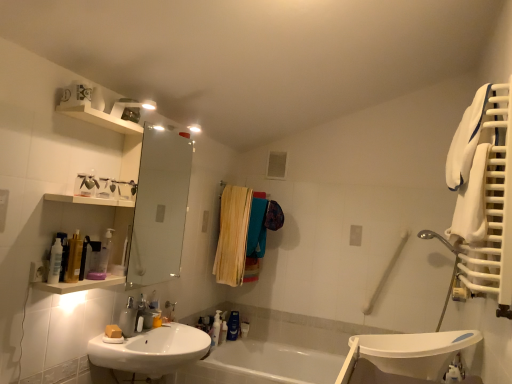
Question: Is white glossy bathtub at center situated inside translucent plastic bottle at lower center, the second toiletry when ordered from right to left, or outside?

Choices:
 (A) inside
 (B) outside

Answer: (B)

Question: In terms of height, does white glossy bathtub at center look taller or shorter compared to translucent plastic bottle at lower center, acting as the second toiletry starting from the left?

Choices:
 (A) short
 (B) tall

Answer: (B)

Question: Which object is positioned farthest from the white glossy bathtub at center?

Choices:
 (A) white glossy sink at lower left
 (B) translucent plastic pump bottle at lower center, the third toiletry in the right-to-left sequence
 (C) wooden laundry at center
 (D) white soft towel at right
 (E) blue glossy bottle at lower center, placed as the 1th toiletry when sorted from right to left

Answer: (D)

Question: Considering the real-world distances, which object is closest to the white soft towel at right?

Choices:
 (A) blue glossy bottle at lower center, positioned as the 3th toiletry in left-to-right order
 (B) translucent plastic pump bottle at lower center, the first toiletry viewed from the left
 (C) white glossy sink at lower left
 (D) matte yellow soap at sink left
 (E) wooden laundry at center

Answer: (C)